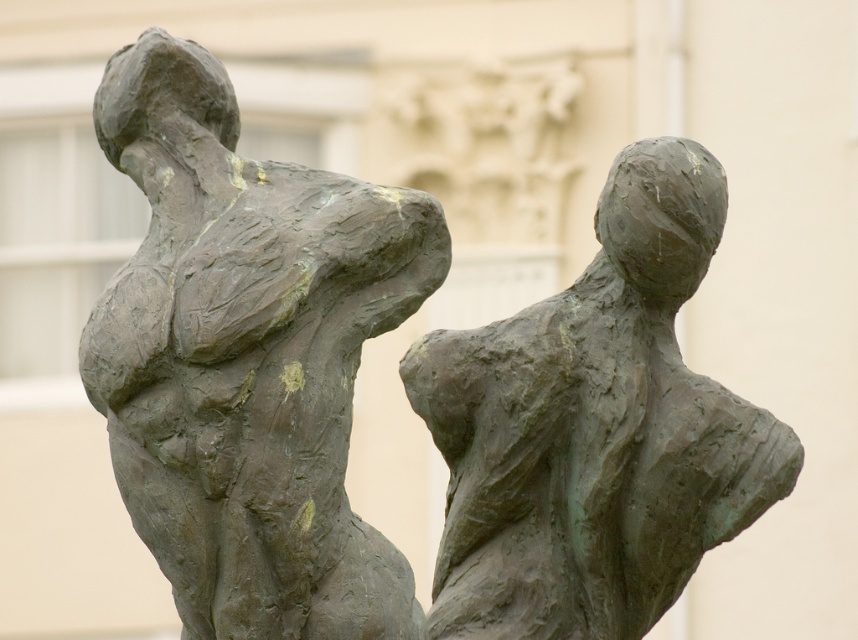
Who is positioned more to the left, bronze statue at center or green patina bronze figure at center?

bronze statue at center

Is bronze statue at center taller than green patina bronze figure at center?

Indeed, bronze statue at center has a greater height compared to green patina bronze figure at center.

Locate an element on the screen. The image size is (858, 640). bronze statue at center is located at coordinates (246, 356).